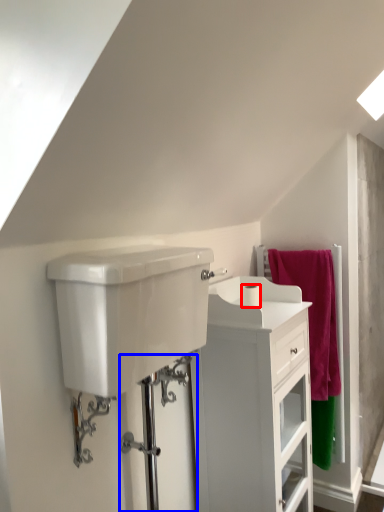
Question: Which of the following is the closest to the observer, toilet paper (highlighted by a red box) or shower door (highlighted by a blue box)?

Choices:
 (A) toilet paper
 (B) shower door

Answer: (B)